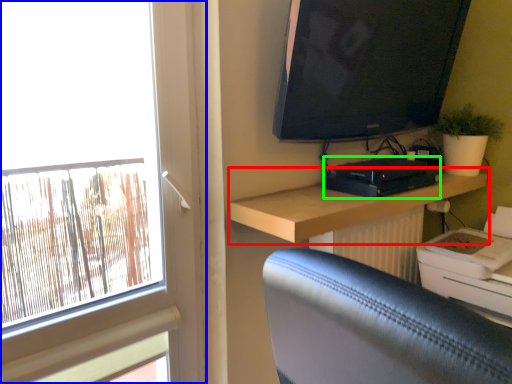
Question: Considering the real-world distances, which object is closest to shelf (highlighted by a red box)? window (highlighted by a blue box) or equipment (highlighted by a green box).

Choices:
 (A) window
 (B) equipment

Answer: (B)